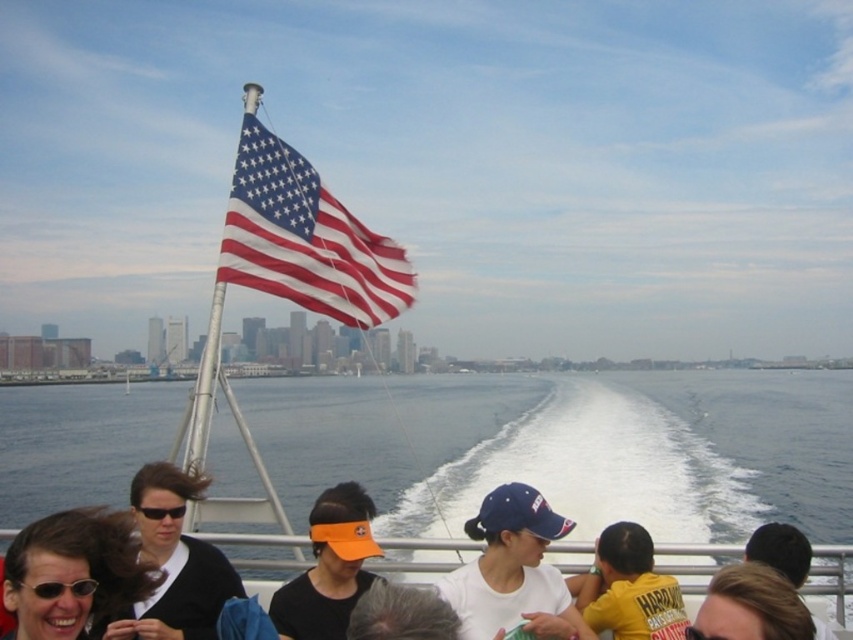
Consider the image. You are a photographer trying to capture a group photo of the passengers on the boat. You notice the matte black shirt at lower left and the blonde hair at lower right are partially overlapping. Based on their positions, which object should you adjust to ensure both are fully visible in the photo?

The matte black shirt at lower left might be wider than blonde hair at lower right, so you should adjust the matte black shirt at lower left to ensure both are fully visible.

You are standing on the deck of the boat and want to reach the point marked at coordinates point (456, 516). If your walking speed is 1.5 meters per second, how long will it take you to reach that point?

The point (456, 516) is 31.24 meters away from the camera, so it will take approximately 20.83 seconds to reach it at a speed of 1.5 meters per second. The calculation is 31.24 divided by 1.5 equals approximately 20.83 seconds.

From the picture: You are standing on the deck of the boat and notice the clear blue water at center and the matte black sunglasses at lower left. Which object appears taller from your viewpoint?

The clear blue water at center appears taller than the matte black sunglasses at lower left because it has a greater height compared to it.